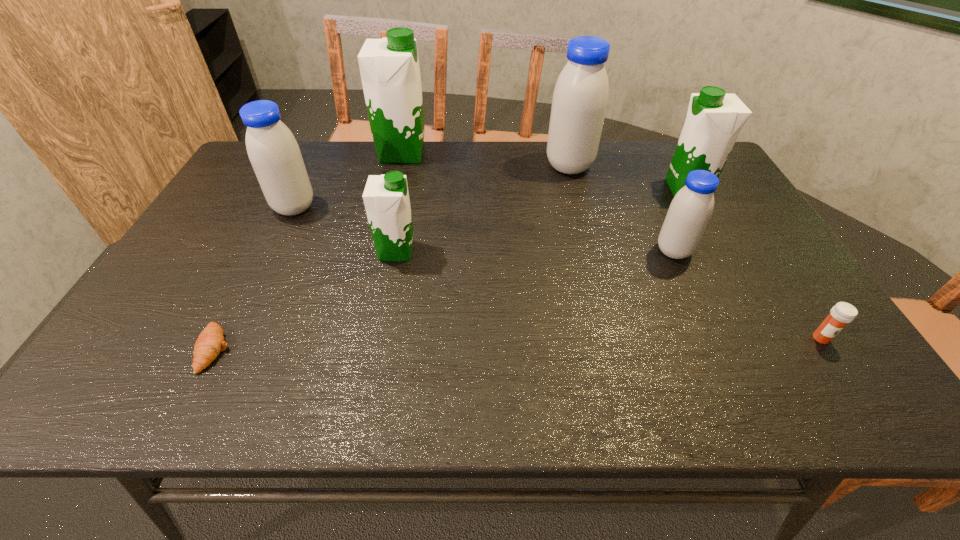
The image size is (960, 540). In the image, there is a desktop. In order to click on vacant space at the right edge in this screenshot , I will do `click(781, 355)`.

Identify the location of vacant point at the far left corner. (244, 163).

Locate an element on the screen. This screenshot has width=960, height=540. vacant space at the near left corner of the desktop is located at coordinates (134, 409).

The image size is (960, 540). Find the location of `free space between the farthest blue soya milk and the second farthest blue soya milk`. free space between the farthest blue soya milk and the second farthest blue soya milk is located at coordinates (432, 186).

Locate an element on the screen. This screenshot has height=540, width=960. free space that is in between the crescent roll and the rightmost soya milk is located at coordinates (451, 269).

This screenshot has height=540, width=960. I want to click on vacant space that's between the farthest blue soya milk and the medicine, so click(x=695, y=252).

Identify the location of free space between the crescent roll and the seventh object from left to right. (451, 269).

Find the location of a particular element. vacant area between the second nearest blue soya milk and the fifth object from left to right is located at coordinates (432, 186).

This screenshot has height=540, width=960. Find the location of `unoccupied area between the second farthest blue soya milk and the farthest green soya milk`. unoccupied area between the second farthest blue soya milk and the farthest green soya milk is located at coordinates (348, 180).

Locate an element on the screen. empty location between the rightmost soya milk and the smallest green soya milk is located at coordinates (542, 220).